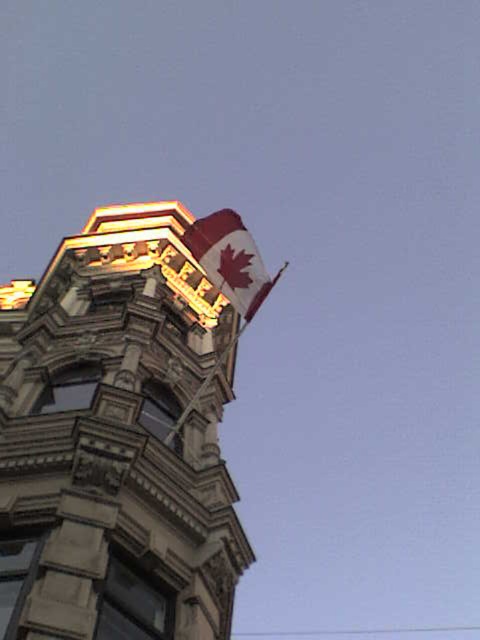
Does polished stone tower at upper center appear on the right side of red and white fabric flag at upper center?

No, polished stone tower at upper center is not to the right of red and white fabric flag at upper center.

Which is more to the right, polished stone tower at upper center or red and white fabric flag at upper center?

red and white fabric flag at upper center

Describe the element at coordinates (117, 440) in the screenshot. I see `polished stone tower at upper center` at that location.

The image size is (480, 640). What are the coordinates of `polished stone tower at upper center` in the screenshot? It's located at (117, 440).

Does red and white fabric flag at upper center appear on the right side of metallic flag pole at upper center?

Incorrect, red and white fabric flag at upper center is not on the right side of metallic flag pole at upper center.

Is red and white fabric flag at upper center bigger than metallic flag pole at upper center?

Indeed, red and white fabric flag at upper center has a larger size compared to metallic flag pole at upper center.

Is point (260, 260) positioned behind point (216, 365)?

That is True.

Where is `red and white fabric flag at upper center`? This screenshot has height=640, width=480. red and white fabric flag at upper center is located at coordinates (229, 259).

Is polished stone tower at upper center below metallic flag pole at upper center?

Yes, polished stone tower at upper center is below metallic flag pole at upper center.

Who is positioned more to the right, polished stone tower at upper center or metallic flag pole at upper center?

metallic flag pole at upper center is more to the right.

Measure the distance between polished stone tower at upper center and camera.

polished stone tower at upper center and camera are 34.57 meters apart from each other.

Identify the location of polished stone tower at upper center. Image resolution: width=480 pixels, height=640 pixels. (117, 440).